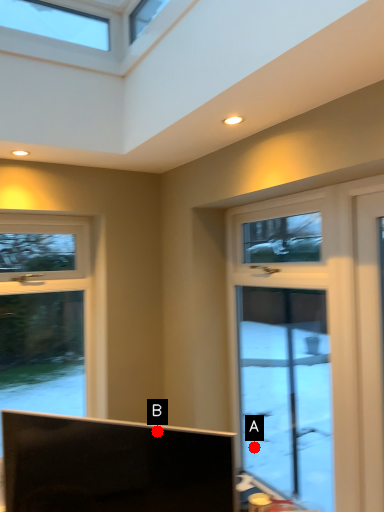
Question: Two points are circled on the image, labeled by A and B beside each circle. Which point is closer to the camera taking this photo?

Choices:
 (A) A is closer
 (B) B is closer

Answer: (B)